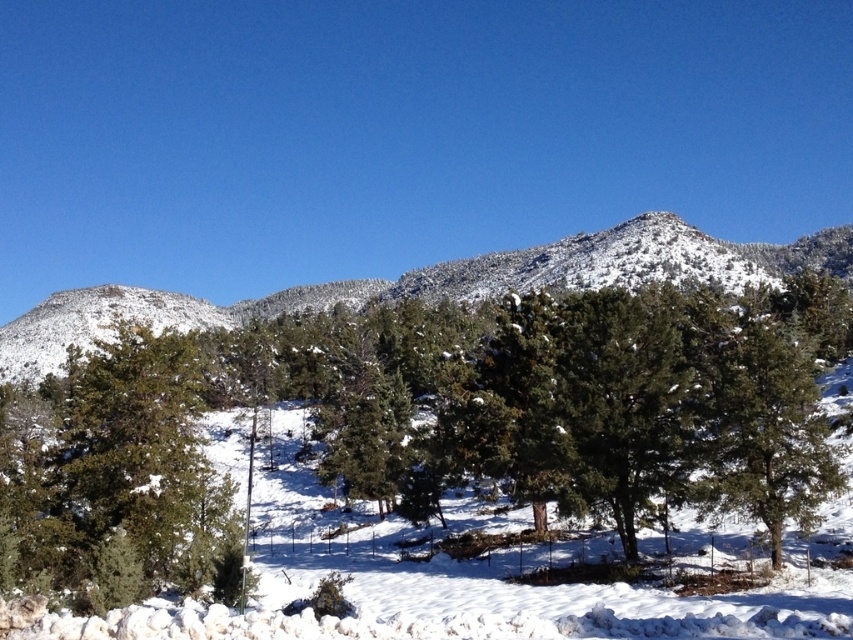
The image size is (853, 640). I want to click on green matte tree at left, so click(115, 476).

Who is lower down, green matte tree at left or snowy pine trees at center?

green matte tree at left

Is point (84, 376) closer to viewer compared to point (851, 250)?

Yes, it is.

At what (x,y) coordinates should I click in order to perform the action: click on green matte tree at left. Please return your answer as a coordinate pair (x, y). Looking at the image, I should click on [115, 476].